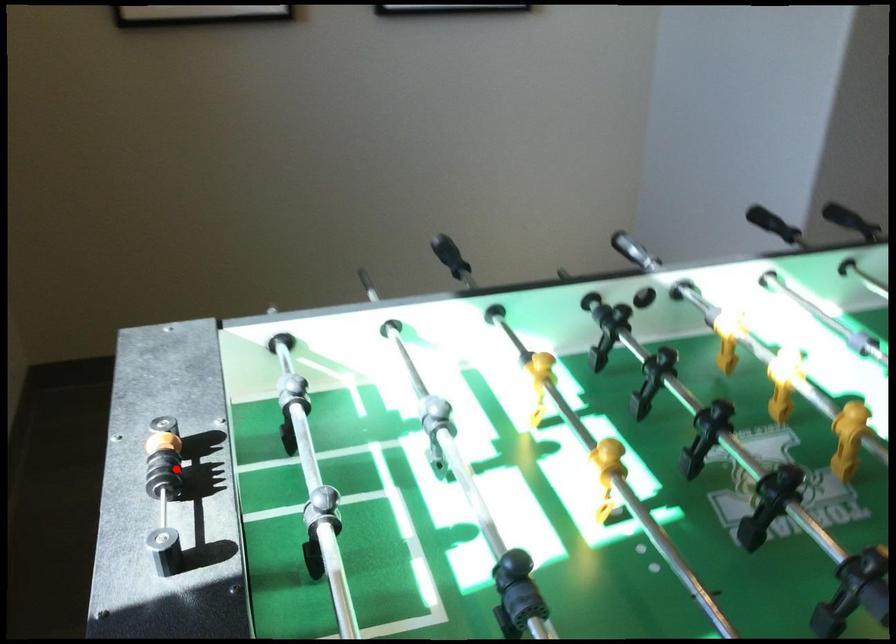
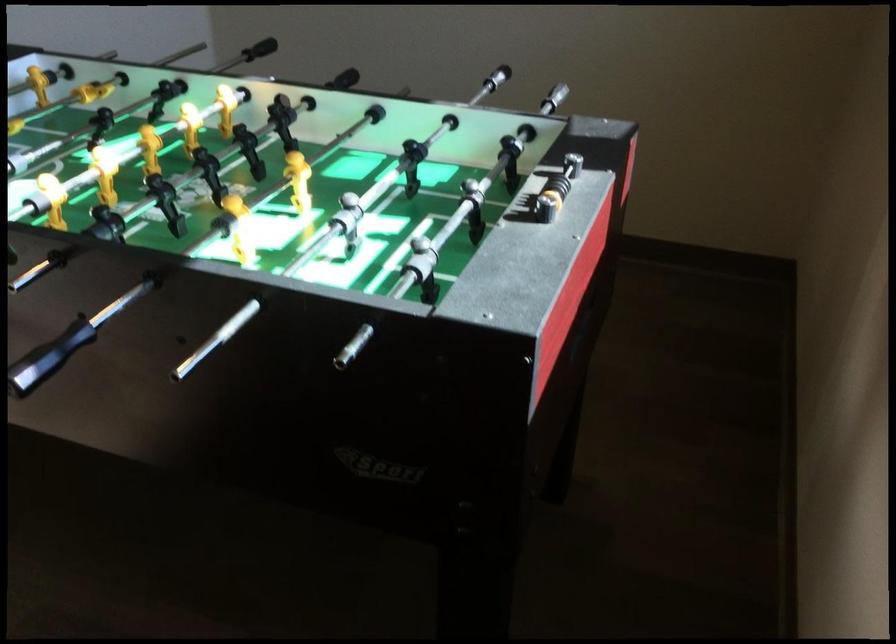
Question: I am providing you with two images of the same scene from different viewpoints. A red point is shown in image1. For the corresponding object point in image2, is it positioned nearer or farther from the camera?

Choices:
 (A) Nearer
 (B) Farther

Answer: (B)